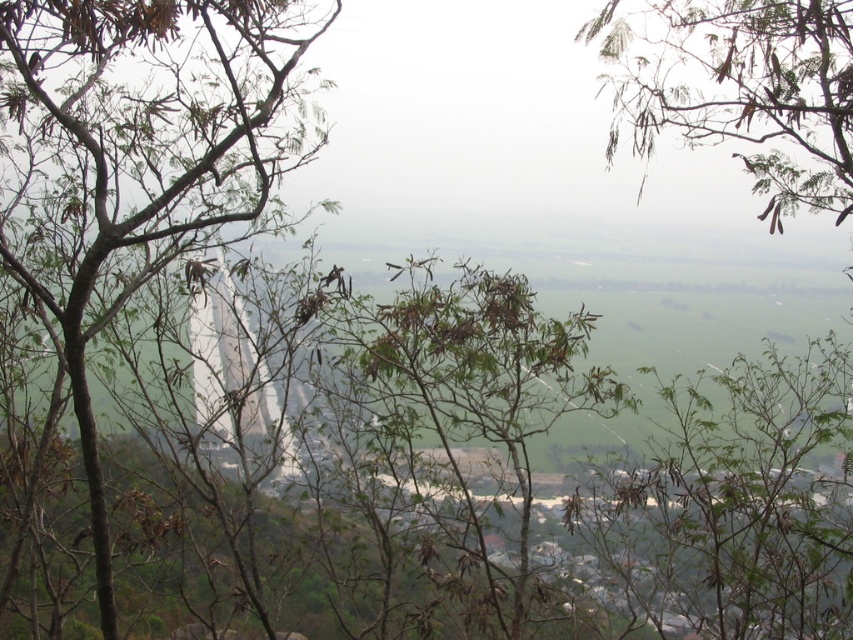
From the picture: Between brown textured tree at center and green leafy branches at upper center, which one has more height?

With more height is brown textured tree at center.

Is brown textured tree at center thinner than green leafy branches at upper center?

No.

What do you see at coordinates (479, 392) in the screenshot?
I see `brown textured tree at center` at bounding box center [479, 392].

At what (x,y) coordinates should I click in order to perform the action: click on brown textured tree at center. Please return your answer as a coordinate pair (x, y). Looking at the image, I should click on (479, 392).

Where is `brown leafy tree at center`? brown leafy tree at center is located at coordinates (138, 156).

Consider the image. Between brown leafy tree at center and brown textured tree at center, which one is positioned lower?

brown textured tree at center is lower down.

Is point (97, 58) farther from camera compared to point (529, 365)?

That is False.

Locate an element on the screen. This screenshot has width=853, height=640. brown leafy tree at center is located at coordinates (138, 156).

Based on the photo, is brown leafy tree at center taller than green leafy branches at upper center?

Yes.

Is brown leafy tree at center to the left of green leafy branches at upper center from the viewer's perspective?

Indeed, brown leafy tree at center is positioned on the left side of green leafy branches at upper center.

Is point (41, 115) farther from viewer compared to point (851, 138)?

Yes, it is behind point (851, 138).

Locate an element on the screen. brown leafy tree at center is located at coordinates (138, 156).